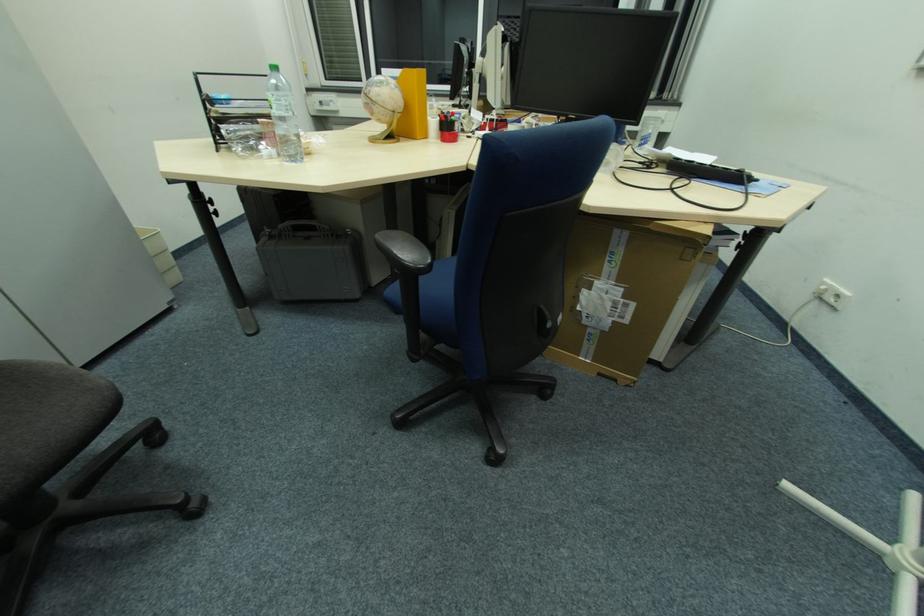
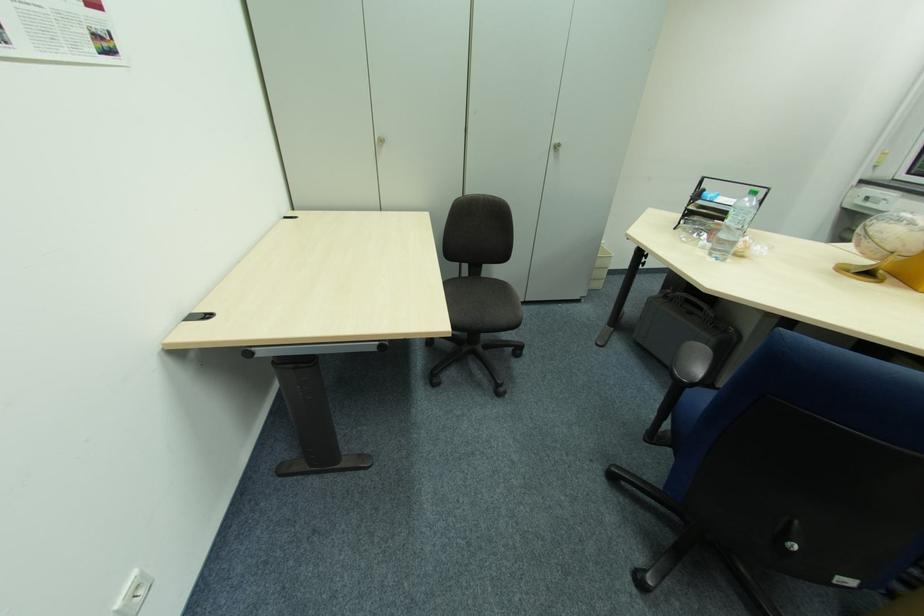
Find the pixel in the second image that matches (x=331, y=237) in the first image.

(711, 323)